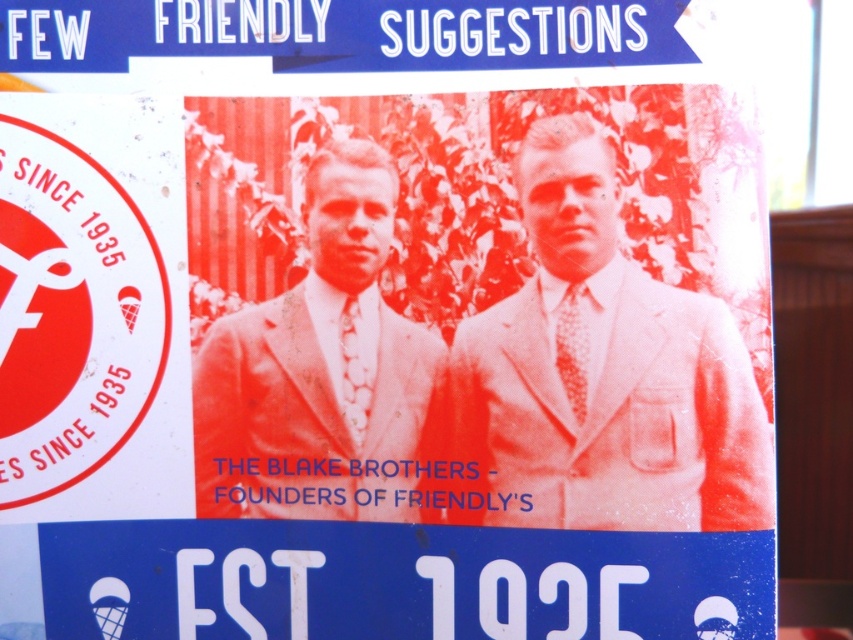
Does white textured suit at center appear over white suit at center?

Incorrect, white textured suit at center is not positioned above white suit at center.

Between point (489, 360) and point (297, 408), which one is positioned in front?

Point (489, 360) is in front.

The height and width of the screenshot is (640, 853). Find the location of `white textured suit at center`. white textured suit at center is located at coordinates (604, 369).